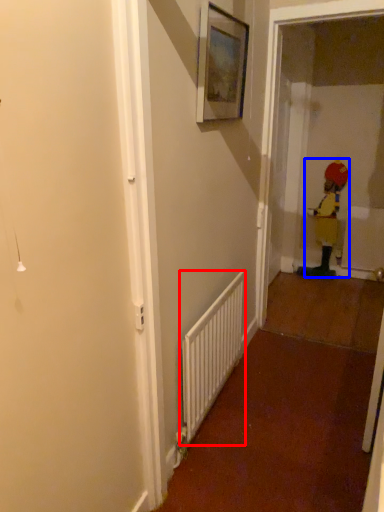
Question: Which object is further to the camera taking this photo, radiator (highlighted by a red box) or toddler (highlighted by a blue box)?

Choices:
 (A) radiator
 (B) toddler

Answer: (B)